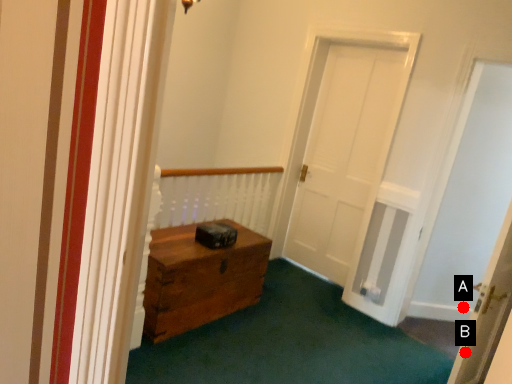
Question: Two points are circled on the image, labeled by A and B beside each circle. Which point is closer to the camera?

Choices:
 (A) A is closer
 (B) B is closer

Answer: (B)